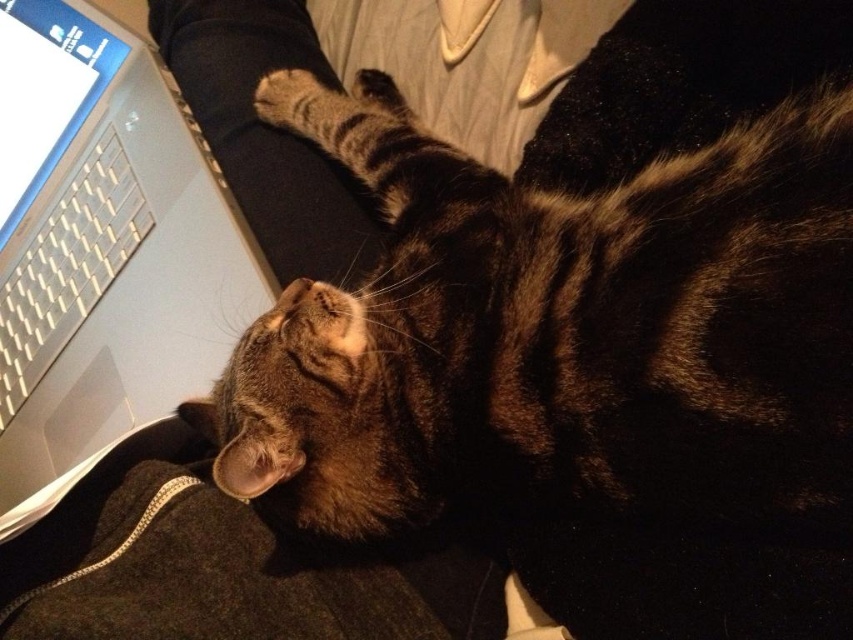
Between sleek silver laptop at left and white plastic keyboard at left, which one has less height?

With less height is white plastic keyboard at left.

You are a GUI agent. You are given a task and a screenshot of the screen. Output one action in this format:
    pyautogui.click(x=<x>, y=<y>)
    Task: Click on the sleek silver laptop at left
    The image size is (853, 640).
    Given the screenshot: What is the action you would take?
    pyautogui.click(x=102, y=248)

Does brown striped fur cat at center have a smaller size compared to sleek silver laptop at left?

Incorrect, brown striped fur cat at center is not smaller in size than sleek silver laptop at left.

Can you confirm if brown striped fur cat at center is positioned to the left of sleek silver laptop at left?

In fact, brown striped fur cat at center is to the right of sleek silver laptop at left.

Image resolution: width=853 pixels, height=640 pixels. What do you see at coordinates (558, 340) in the screenshot?
I see `brown striped fur cat at center` at bounding box center [558, 340].

The height and width of the screenshot is (640, 853). In order to click on brown striped fur cat at center in this screenshot , I will do `click(558, 340)`.

Is brown striped fur cat at center closer to the viewer compared to white plastic keyboard at left?

Yes, brown striped fur cat at center is in front of white plastic keyboard at left.

Is brown striped fur cat at center above white plastic keyboard at left?

Incorrect, brown striped fur cat at center is not positioned above white plastic keyboard at left.

Does point (357, 492) come in front of point (144, 218)?

Yes, it is.

Identify the location of brown striped fur cat at center. The image size is (853, 640). (558, 340).